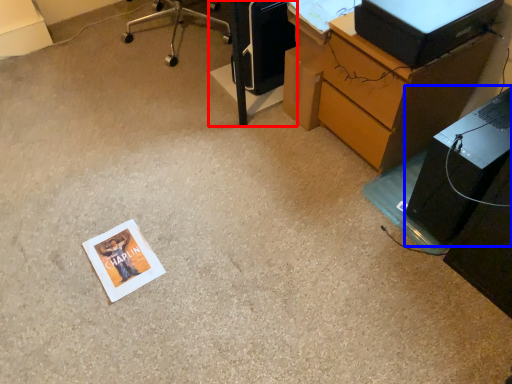
Question: Which object is closer to the camera taking this photo, furniture (highlighted by a red box) or computer tower (highlighted by a blue box)?

Choices:
 (A) furniture
 (B) computer tower

Answer: (B)